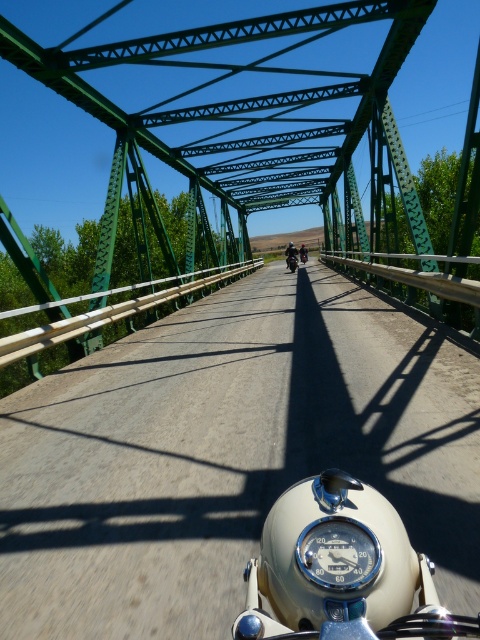
Does shiny black motorcycle at center have a greater width compared to shiny chrome helmet at center?

Yes.

Is point (288, 268) positioned after point (302, 253)?

No, it is not.

This screenshot has width=480, height=640. Describe the element at coordinates (291, 257) in the screenshot. I see `shiny black motorcycle at center` at that location.

I want to click on shiny black motorcycle at center, so click(x=291, y=257).

Who is positioned more to the right, white glossy speedometer at center or shiny black motorcycle at center?

shiny black motorcycle at center is more to the right.

Who is more distant from viewer, (262,541) or (290,252)?

Point (290,252)

Identify the location of white glossy speedometer at center. This screenshot has height=640, width=480. [340, 570].

Does white glossy speedometer at center have a smaller size compared to shiny chrome helmet at center?

Indeed, white glossy speedometer at center has a smaller size compared to shiny chrome helmet at center.

Which is in front, point (277, 504) or point (302, 260)?

Positioned in front is point (277, 504).

At what (x,y) coordinates should I click in order to perform the action: click on white glossy speedometer at center. Please return your answer as a coordinate pair (x, y). Image resolution: width=480 pixels, height=640 pixels. Looking at the image, I should click on (340, 570).